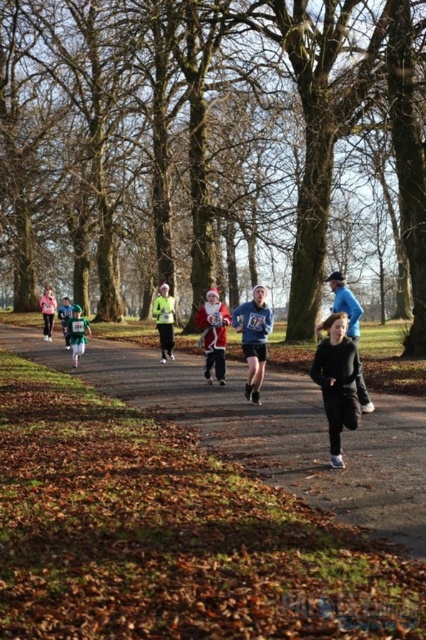
You are a photographer positioned at the starting line of the race. You want to capture both the blue fabric shirt at center and the reflective yellow jacket at center in your photo. Which runner should you focus on first to ensure both are visible?

The blue fabric shirt at center is in front of the reflective yellow jacket at center, so you should focus on the blue fabric shirt at center first to ensure both are visible in the photo.

You are a photographer positioned at the starting line of the race. You want to capture a photo that includes both the black matte running suit at lower right and the blue fabric shirt at center. Considering their sizes, which object should you focus on to ensure both fit in the frame?

Since the black matte running suit at lower right occupies less space than the blue fabric shirt at center, you should focus on the blue fabric shirt at center to ensure both fit in the frame as it takes up more space and will require a wider angle or closer positioning to include both.